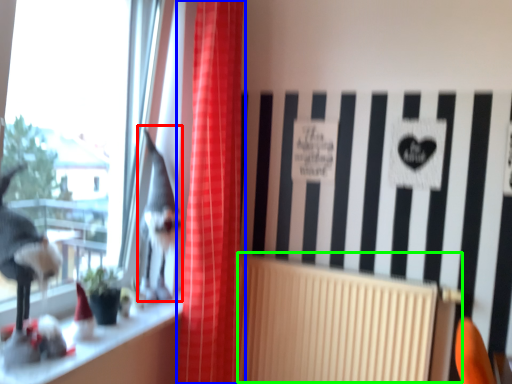
Question: Estimate the real-world distances between objects in this image. Which object is farther from animal (highlighted by a red box), curtain (highlighted by a blue box) or radiator (highlighted by a green box)?

Choices:
 (A) curtain
 (B) radiator

Answer: (B)